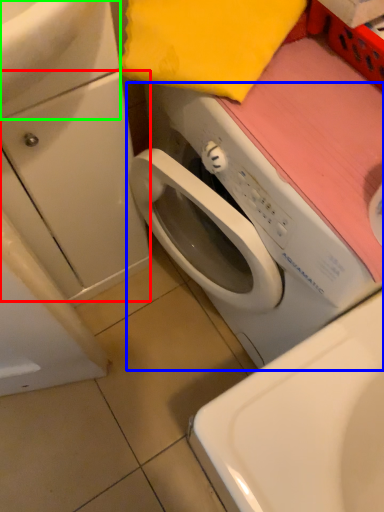
Question: Which is farther away from drawer (highlighted by a red box)? washing machine (highlighted by a blue box) or sink (highlighted by a green box)?

Choices:
 (A) washing machine
 (B) sink

Answer: (B)